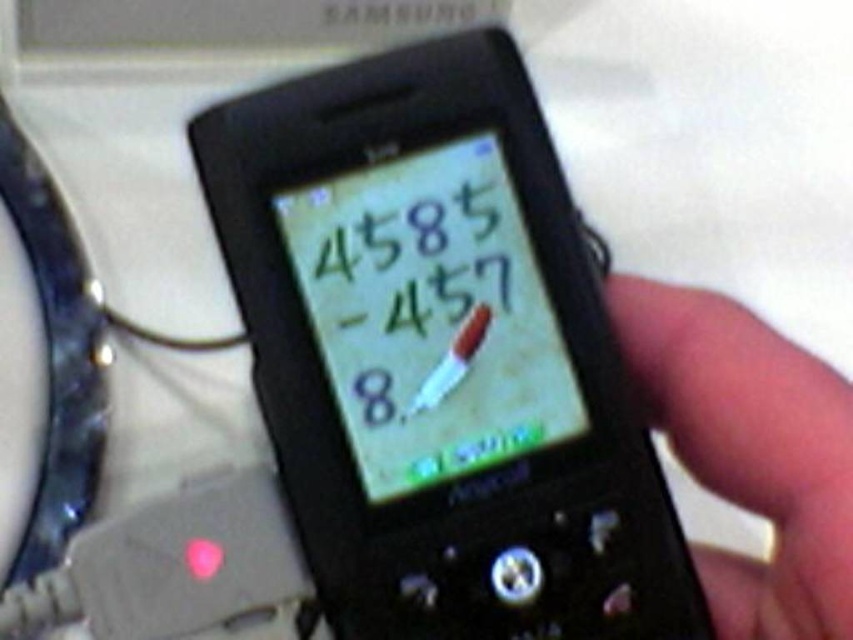
Which is more to the right, black plastic phone at center or black matte phone at right?

black matte phone at right is more to the right.

Can you confirm if black plastic phone at center is smaller than black matte phone at right?

No, black plastic phone at center is not smaller than black matte phone at right.

What do you see at coordinates (440, 355) in the screenshot? I see `black plastic phone at center` at bounding box center [440, 355].

This screenshot has width=853, height=640. Identify the location of black plastic phone at center. (440, 355).